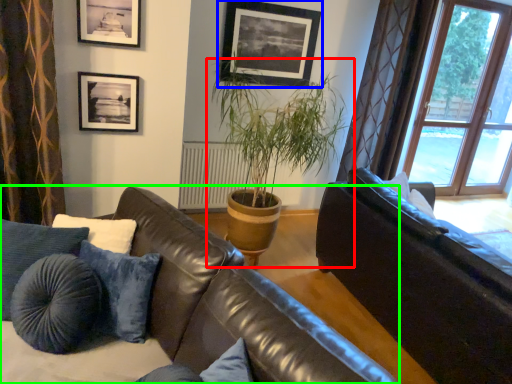
Question: Which is nearer to the houseplant (highlighted by a red box)? picture frame (highlighted by a blue box) or studio couch (highlighted by a green box).

Choices:
 (A) picture frame
 (B) studio couch

Answer: (A)